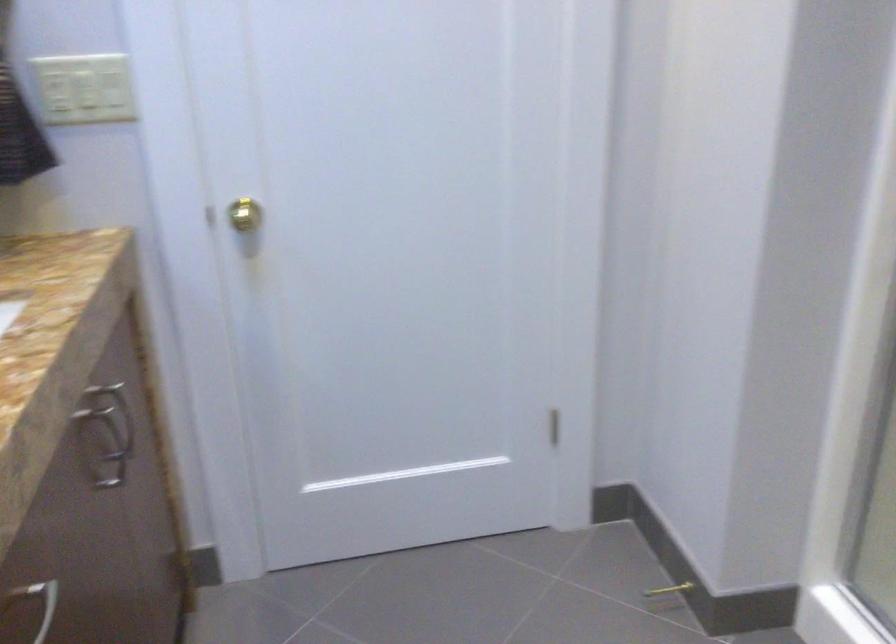
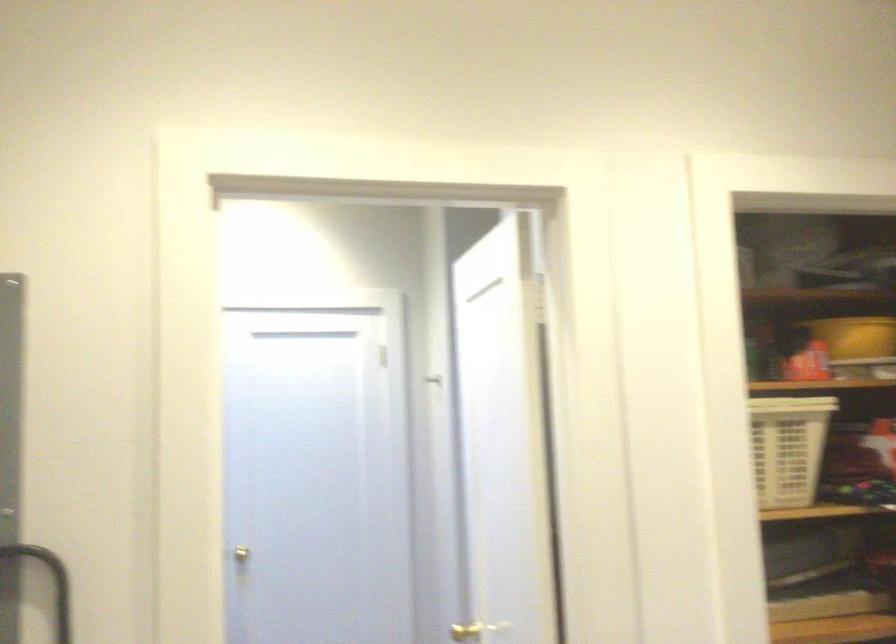
Question: I am providing you with two images of the same scene from different viewpoints. Which of the following objects are not visible in image2?

Choices:
 (A) light switch
 (B) yellow container
 (C) blender jar
 (D) gold doorknob

Answer: (A)